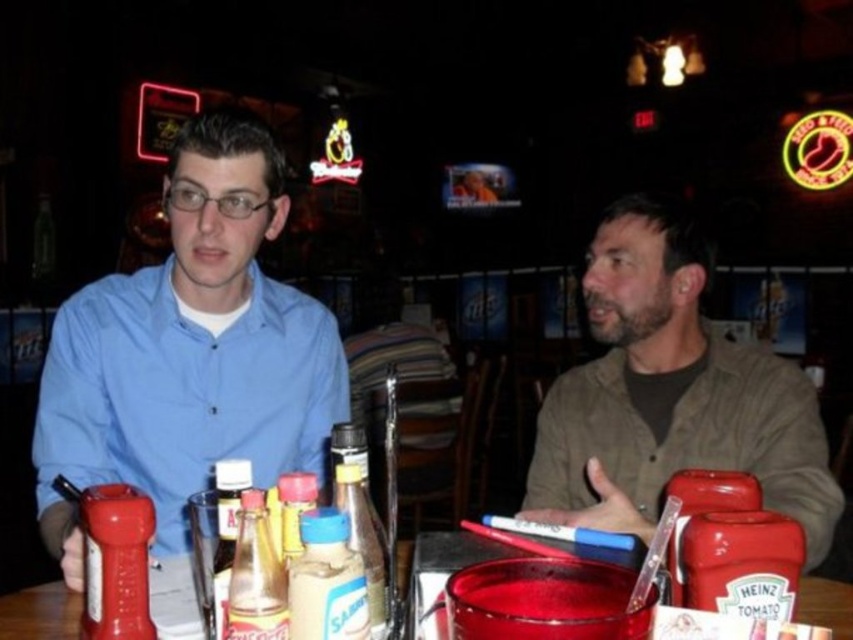
You are a waiter at Red Robin and need to deliver a drink to the table. The translucent plastic cup at center is on the table. Is the matte blue shirt at left blocking the path to the cup?

The matte blue shirt at left is taller than the translucent plastic cup at center, so it might block the path to the cup. You should check if the shirt is placed in a way that obstructs access to the cup before delivering the drink.

You are a photographer trying to capture a candid shot of the person wearing the matte blue shirt at left without them noticing. You have a camera with a focal length of 50mm. Considering the distance between you and the subject, is this focal length sufficient to avoid them noticing your camera? Please explain your reasoning based on the given information.

The matte blue shirt at left and the camera are 35.63 inches apart. A 50mm focal length is considered standard and typically allows for discreet photography at such a close distance, as it mimics the human field of view. However, being only 35.63 inches away might make the subject aware of the camera due to the close proximity, despite the focal length.

You are a server at Red Robin and need to deliver a drink to the customer. The customer is sitting at the table with a matte blue shirt at left and a translucent plastic cup at center. Which object should you avoid knocking over while reaching for the cup?

You should avoid knocking over the matte blue shirt at left because the translucent plastic cup at center is behind it, so reaching for the cup might cause the shirt to move or tip over.